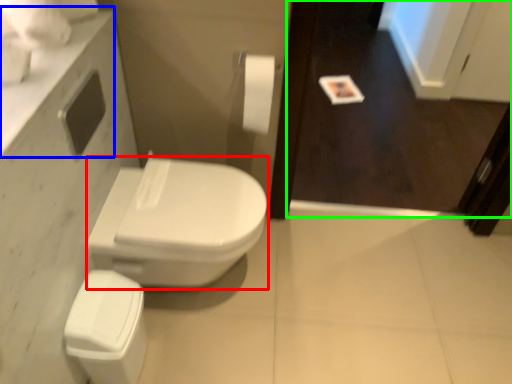
Question: Based on their relative distances, which object is farther from bidet (highlighted by a red box)? Choose from counter top (highlighted by a blue box) and screen door (highlighted by a green box).

Choices:
 (A) counter top
 (B) screen door

Answer: (B)